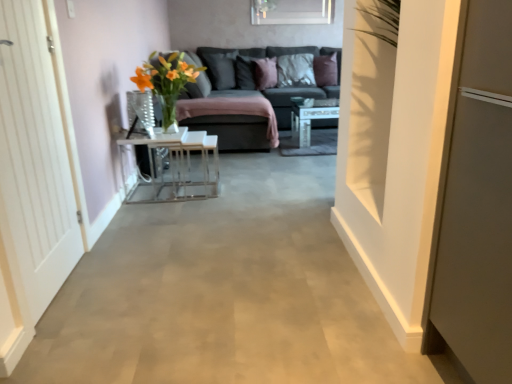
Measure the distance between point [263,70] and camera.

Point [263,70] is 5.22 meters away from camera.

What do you see at coordinates (178, 163) in the screenshot? I see `metallic white table at center` at bounding box center [178, 163].

Find the location of `white wooden door at left`. white wooden door at left is located at coordinates (35, 157).

I want to click on velvet dark gray pillow at upper center, which appears as the 2th pillow when viewed from the left, so click(x=245, y=72).

Where is `velvet dark gray pillow at center, the fourth pillow in the left-to-right sequence`? This screenshot has height=384, width=512. velvet dark gray pillow at center, the fourth pillow in the left-to-right sequence is located at coordinates (295, 70).

Does clear glass vase at center have a lesser height compared to dark gray fabric couch at center?

Correct, clear glass vase at center is not as tall as dark gray fabric couch at center.

From the image's perspective, would you say clear glass vase at center is positioned over dark gray fabric couch at center?

Incorrect, from the image's perspective, clear glass vase at center is lower than dark gray fabric couch at center.

Based on the photo, can you tell me how much clear glass vase at center and dark gray fabric couch at center differ in facing direction?

clear glass vase at center and dark gray fabric couch at center are facing 105 degrees away from each other.

Who is bigger, clear glass vase at center or dark gray fabric couch at center?

With larger size is dark gray fabric couch at center.

From the image's perspective, does velvet dark gray pillow at upper center, which appears as the 2th pillow when viewed from the left, appear lower than clear glass vase at center?

No, from the image's perspective, velvet dark gray pillow at upper center, which appears as the 2th pillow when viewed from the left, is not below clear glass vase at center.

In the scene shown: Is velvet dark gray pillow at upper center, positioned as the fourth pillow in right-to-left order, positioned with its back to clear glass vase at center?

That's not correct — velvet dark gray pillow at upper center, positioned as the fourth pillow in right-to-left order, is not looking away from clear glass vase at center.

The width and height of the screenshot is (512, 384). Identify the location of glass vase below the velvet dark gray pillow at upper center, which appears as the 2th pillow when viewed from the left (from the image's perspective). (142, 110).

Looking at this image, could you measure the distance between velvet dark gray pillow at upper center, positioned as the fourth pillow in right-to-left order, and clear glass vase at center?

velvet dark gray pillow at upper center, positioned as the fourth pillow in right-to-left order, is 7.99 feet away from clear glass vase at center.

Considering the sizes of objects velvet dark gray pillow at center, the second pillow viewed from the right, and dark gray fabric couch at center in the image provided, who is bigger, velvet dark gray pillow at center, the second pillow viewed from the right, or dark gray fabric couch at center?

Bigger between the two is dark gray fabric couch at center.

From the image's perspective, between velvet dark gray pillow at center, the second pillow viewed from the right, and dark gray fabric couch at center, who is located below?

dark gray fabric couch at center appears lower in the image.

From a real-world perspective, between velvet dark gray pillow at center, the fourth pillow in the left-to-right sequence, and dark gray fabric couch at center, who is vertically higher?

velvet dark gray pillow at center, the fourth pillow in the left-to-right sequence.

Considering the points (282, 61) and (191, 87), which point is in front, point (282, 61) or point (191, 87)?

Point (191, 87)

Is metallic white table at center smaller than purple velvet pillow at center, the third pillow viewed from the right?

Incorrect, metallic white table at center is not smaller in size than purple velvet pillow at center, the third pillow viewed from the right.

From a real-world perspective, between metallic white table at center and purple velvet pillow at center, the third pillow viewed from the right, who is vertically higher?

purple velvet pillow at center, the third pillow viewed from the right, is physically above.

Can you see metallic white table at center touching purple velvet pillow at center, the third pillow viewed from the right?

No, metallic white table at center is not next to purple velvet pillow at center, the third pillow viewed from the right.

Considering the sizes of metallic white table at center and purple velvet pillow at center, the 3th pillow when ordered from left to right, in the image, is metallic white table at center wider or thinner than purple velvet pillow at center, the 3th pillow when ordered from left to right,?

metallic white table at center is wider than purple velvet pillow at center, the 3th pillow when ordered from left to right.

Is dark gray fabric couch at center turned away from suede-like gray pillow at center, the fifth pillow in the right-to-left sequence?

Yes, dark gray fabric couch at center is facing away from suede-like gray pillow at center, the fifth pillow in the right-to-left sequence.

Locate an element on the screen. This screenshot has width=512, height=384. the 3rd pillow positioned above the dark gray fabric couch at center (from the image's perspective) is located at coordinates (221, 70).

Is point (246, 113) in front of point (227, 81)?

That is True.

Which object is more forward, dark gray fabric couch at center or suede-like gray pillow at center, placed as the 1th pillow when sorted from left to right?

dark gray fabric couch at center is closer to the camera.

Is point (207, 63) farther from camera compared to point (229, 92)?

Yes, it is.

Does suede-like gray pillow at center, placed as the 1th pillow when sorted from left to right, have a greater width compared to dark gray fabric couch at center?

No.

Would you say dark gray fabric couch at center is part of suede-like gray pillow at center, placed as the 1th pillow when sorted from left to right,'s contents?

That's incorrect, dark gray fabric couch at center is not inside suede-like gray pillow at center, placed as the 1th pillow when sorted from left to right.

Measure the distance between suede-like gray pillow at center, placed as the 1th pillow when sorted from left to right, and dark gray fabric couch at center.

They are 3.78 feet apart.

Is point (137, 94) closer or farther from the camera than point (252, 71)?

Clearly, point (137, 94) is closer to the camera than point (252, 71).

In terms of size, does clear glass vase at center appear bigger or smaller than velvet dark gray pillow at upper center, which appears as the 2th pillow when viewed from the left?

Considering their sizes, clear glass vase at center takes up less space than velvet dark gray pillow at upper center, which appears as the 2th pillow when viewed from the left.

From a real-world perspective, is clear glass vase at center physically below velvet dark gray pillow at upper center, which appears as the 2th pillow when viewed from the left?

Yes, from a real-world perspective, clear glass vase at center is below velvet dark gray pillow at upper center, which appears as the 2th pillow when viewed from the left.

Does clear glass vase at center have a lesser height compared to velvet dark gray pillow at upper center, positioned as the fourth pillow in right-to-left order?

Correct, clear glass vase at center is not as tall as velvet dark gray pillow at upper center, positioned as the fourth pillow in right-to-left order.

I want to click on studio couch above the clear glass vase at center (from the image's perspective), so click(249, 104).

Identify the location of glass vase that is on the left side of velvet dark gray pillow at upper center, positioned as the fourth pillow in right-to-left order. The image size is (512, 384). coord(142,110).

Looking at this image, based on their spatial positions, is white wooden door at left or velvet dark gray pillow at center, the fourth pillow in the left-to-right sequence, closer to clear glass vase at center?

Based on the image, white wooden door at left appears to be nearer to clear glass vase at center.

Estimate the real-world distances between objects in this image. Which object is closer to clear glass vase at center, suede-like gray pillow at center, placed as the 1th pillow when sorted from left to right, or white wooden door at left?

Among the two, white wooden door at left is located nearer to clear glass vase at center.

From the image, which object appears to be farther from purple velvet pillow at upper center, which is counted as the first pillow, starting from the right, metallic white table at center or white wooden door at left?

white wooden door at left is further to purple velvet pillow at upper center, which is counted as the first pillow, starting from the right.

Which object lies further to the anchor point velvet dark gray pillow at center, the second pillow viewed from the right, suede-like gray pillow at center, the fifth pillow in the right-to-left sequence, or clear glass vase at center?

Based on the image, clear glass vase at center appears to be further to velvet dark gray pillow at center, the second pillow viewed from the right.

From the image, which object appears to be farther from velvet dark gray pillow at center, the second pillow viewed from the right, purple velvet pillow at upper center, which is counted as the first pillow, starting from the right, or clear glass vase at center?

clear glass vase at center is positioned further to the anchor velvet dark gray pillow at center, the second pillow viewed from the right.

Based on the photo, from the image, which object appears to be farther from purple velvet pillow at upper center, which is counted as the first pillow, starting from the right, purple velvet pillow at center, the third pillow viewed from the right, or clear glass vase at center?

clear glass vase at center lies further to purple velvet pillow at upper center, which is counted as the first pillow, starting from the right, than the other object.

Estimate the real-world distances between objects in this image. Which object is further from suede-like gray pillow at center, placed as the 1th pillow when sorted from left to right, metallic white table at center or white wooden door at left?

white wooden door at left.

From the image, which object appears to be farther from purple velvet pillow at center, the 3th pillow when ordered from left to right, purple velvet pillow at upper center, which is counted as the first pillow, starting from the right, or clear glass vase at center?

Based on the image, clear glass vase at center appears to be further to purple velvet pillow at center, the 3th pillow when ordered from left to right.

Where is `pillow between purple velvet pillow at center, the third pillow viewed from the right, and purple velvet pillow at upper center, which is counted as the first pillow, starting from the right, from left to right`? pillow between purple velvet pillow at center, the third pillow viewed from the right, and purple velvet pillow at upper center, which is counted as the first pillow, starting from the right, from left to right is located at coordinates (295, 70).

The width and height of the screenshot is (512, 384). Identify the location of glass vase positioned between white wooden door at left and velvet dark gray pillow at center, the fourth pillow in the left-to-right sequence, from near to far. (142, 110).

Locate an element on the screen. This screenshot has height=384, width=512. table between white wooden door at left and suede-like gray pillow at center, the fifth pillow in the right-to-left sequence, from front to back is located at coordinates (178, 163).

I want to click on studio couch between metallic white table at center and suede-like gray pillow at center, placed as the 1th pillow when sorted from left to right, along the z-axis, so click(249, 104).